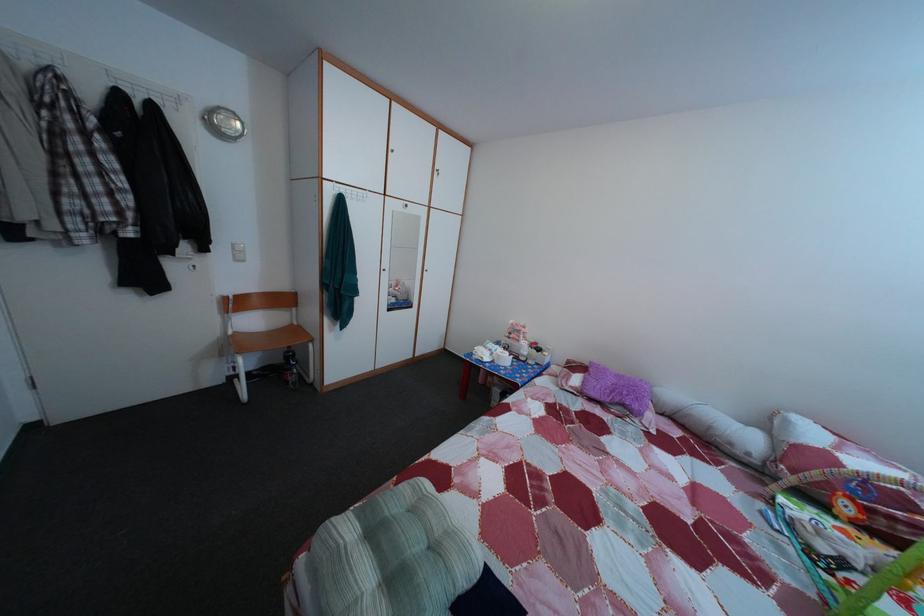
Identify the location of grey bolster pillow. The height and width of the screenshot is (616, 924). (x=393, y=556).